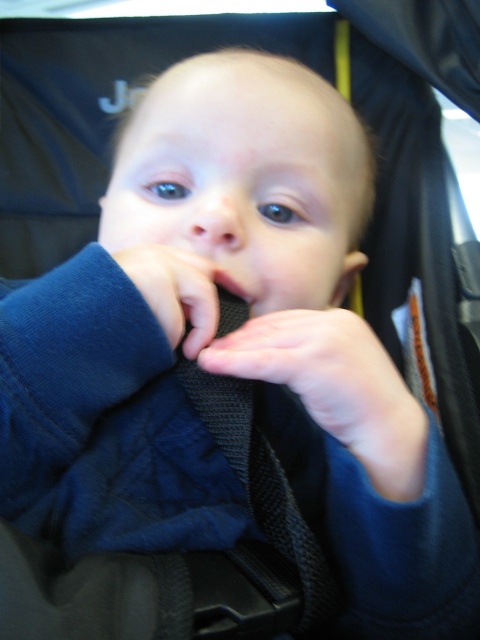
Question: Does matte black strap at center have a larger size compared to dark blue fabric at center?

Choices:
 (A) yes
 (B) no

Answer: (A)

Question: Is matte black strap at center above matte black mouth at center?

Choices:
 (A) yes
 (B) no

Answer: (B)

Question: Estimate the real-world distances between objects in this image. Which object is closer to the matte black mouth at center?

Choices:
 (A) dark blue fabric at center
 (B) matte black strap at center

Answer: (A)

Question: Among these points, which one is nearest to the camera?

Choices:
 (A) (254, 298)
 (B) (189, 300)
 (C) (416, 468)

Answer: (C)

Question: Which object is positioned farthest from the dark blue fabric at center?

Choices:
 (A) matte black strap at center
 (B) matte black mouth at center

Answer: (A)

Question: In this image, where is dark blue fabric at center located relative to matte black mouth at center?

Choices:
 (A) left
 (B) right

Answer: (A)